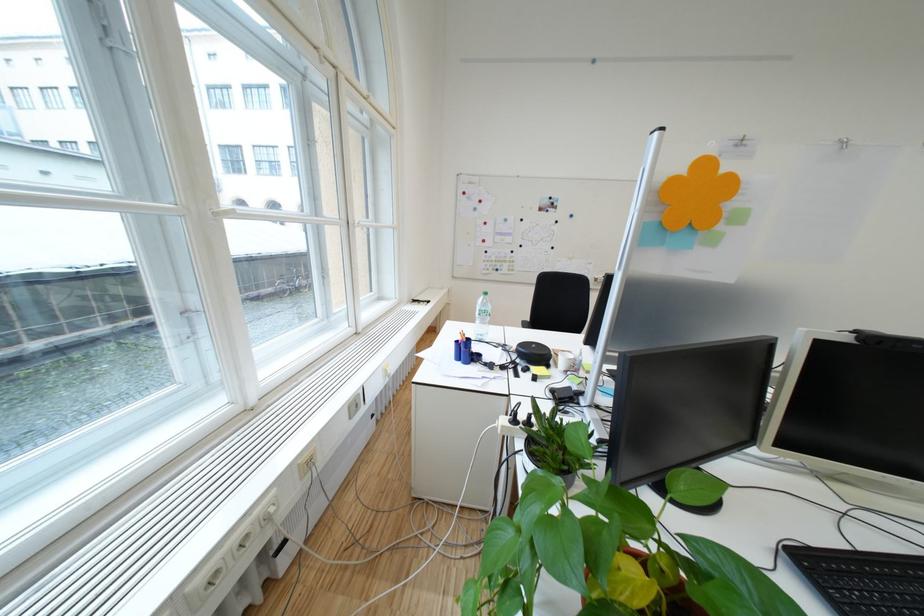
This screenshot has width=924, height=616. In order to click on plastic water bottle in this screenshot , I will do `click(481, 317)`.